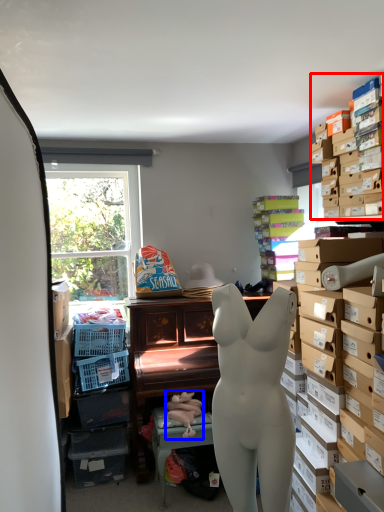
Question: Which of the following is the closest to the observer, shelf (highlighted by a red box) or toy (highlighted by a blue box)?

Choices:
 (A) shelf
 (B) toy

Answer: (A)